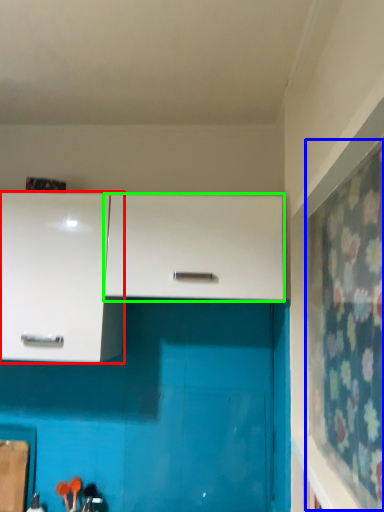
Question: Which object is the closest to the cabinetry (highlighted by a red box)? Choose among these: curtain (highlighted by a blue box) or cabinetry (highlighted by a green box).

Choices:
 (A) curtain
 (B) cabinetry

Answer: (B)